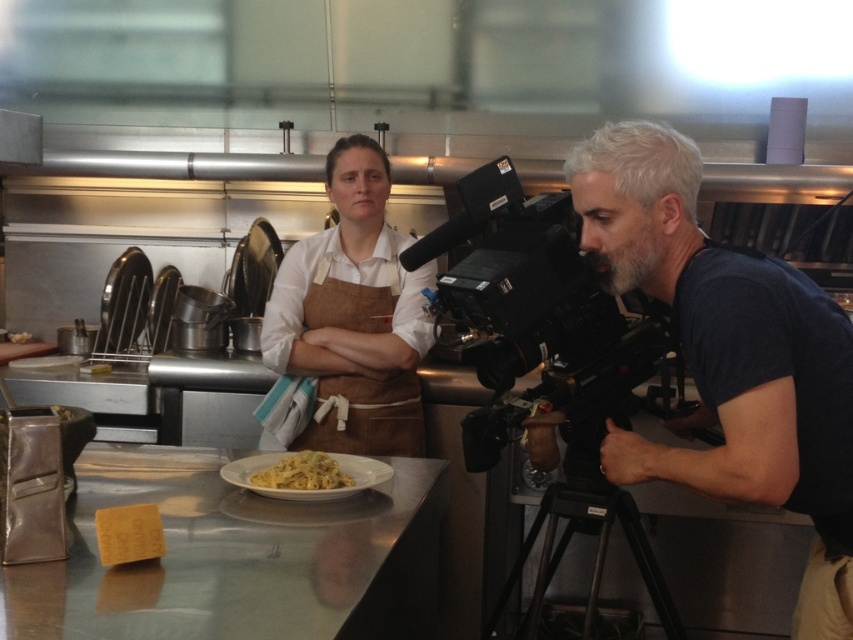
Question: Which object is farther from the camera taking this photo?

Choices:
 (A) metallic stainless steel counter at center
 (B) white glossy plate at center
 (C) brown apron at center
 (D) black metal tripod at lower right

Answer: (C)

Question: Is dark blue t-shirt at right behind black metal tripod at lower right?

Choices:
 (A) no
 (B) yes

Answer: (A)

Question: Is white glossy plate at center thinner than white creamy pasta at center?

Choices:
 (A) yes
 (B) no

Answer: (B)

Question: Is brown apron at center in front of black metal tripod at lower right?

Choices:
 (A) yes
 (B) no

Answer: (B)

Question: Which object appears farthest from the camera in this image?

Choices:
 (A) white glossy plate at center
 (B) dark blue t-shirt at right
 (C) black plastic video camera at right
 (D) black metal tripod at lower right

Answer: (D)

Question: Which point appears closest to the camera in this image?

Choices:
 (A) (482, 433)
 (B) (827, 468)
 (C) (635, 556)
 (D) (378, 336)

Answer: (B)